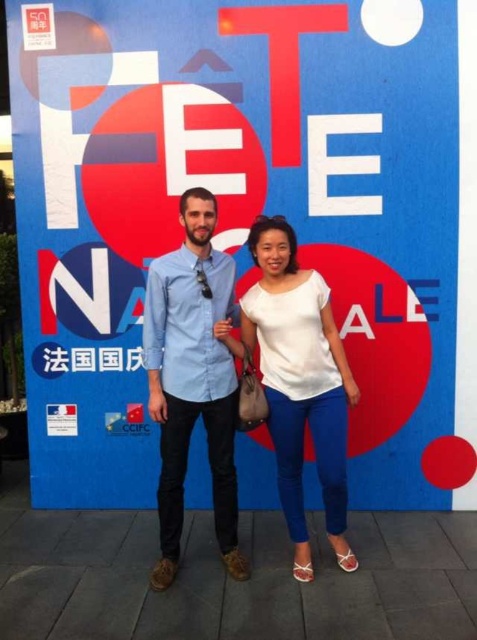
You are a photographer at a National Day event. You need to position two subjects wearing a blue denim shirt at center and a white matte blouse at center so that their heights are balanced in the photo. Which subject should you place on a lower platform to achieve this?

The blue denim shirt at center is much taller than the white matte blouse at center. To balance their heights, place the blue denim shirt at center on a lower platform so that both appear level in the photo.

What is the coordinate of the blue denim shirt at center?

The blue denim shirt at center is located at point (193,378).